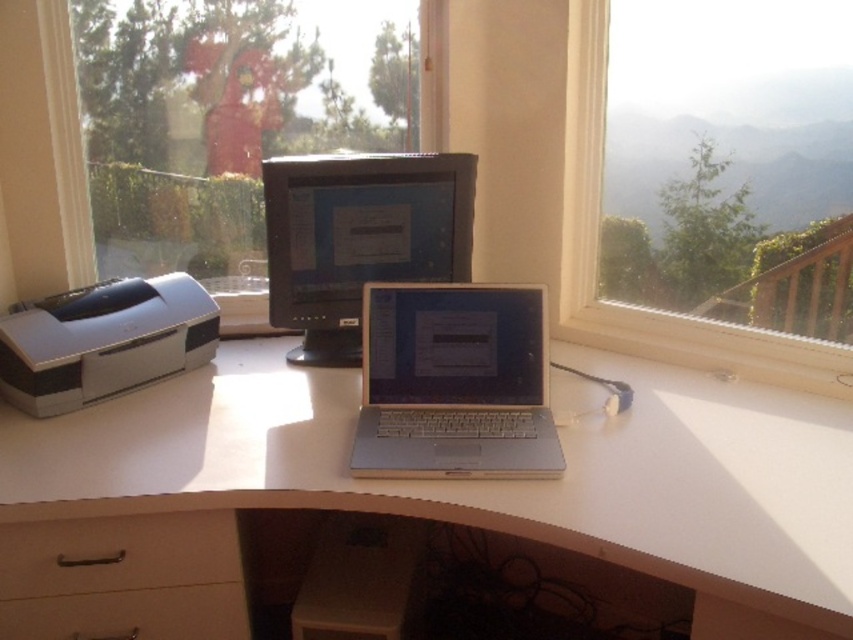
You are organizing cables in the workspace and need to connect a new device to the white glossy printer at left and the brown matte drawer at lower left. Since both are on the desk, which one is closer to you as you sit at the desk?

The white glossy printer at left is closer to you because it is further to the viewer than the brown matte drawer at lower left, meaning it occupies a more forward position on the desk.

You are organizing your home office and want to place a large printer on the desk. Given that the white wood computer desk at center and the white matte drawer at lower left are both available, which one is more suitable for placing the printer?

The white wood computer desk at center is bigger than the white matte drawer at lower left, so it is more suitable for placing the printer.